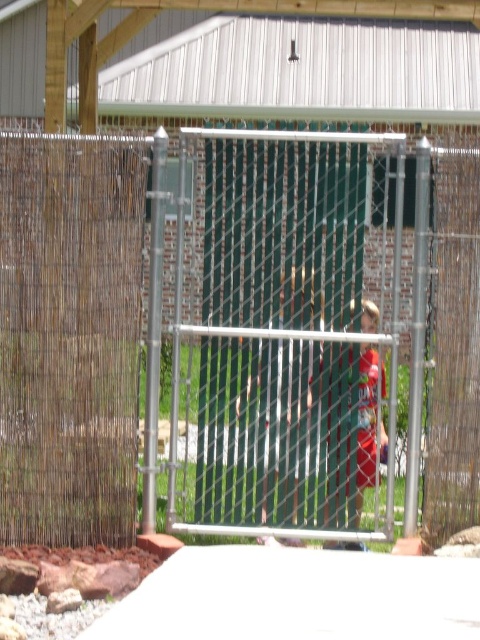
Question: Is brown woven mat at left smaller than red cotton shirt at center?

Choices:
 (A) yes
 (B) no

Answer: (B)

Question: Is brown woven mat at left thinner than red cotton shirt at center?

Choices:
 (A) yes
 (B) no

Answer: (B)

Question: Can you confirm if brown woven mat at left is bigger than red cotton shirt at center?

Choices:
 (A) no
 (B) yes

Answer: (B)

Question: Which of the following is the closest to the observer?

Choices:
 (A) brown woven mat at left
 (B) red cotton shirt at center

Answer: (A)